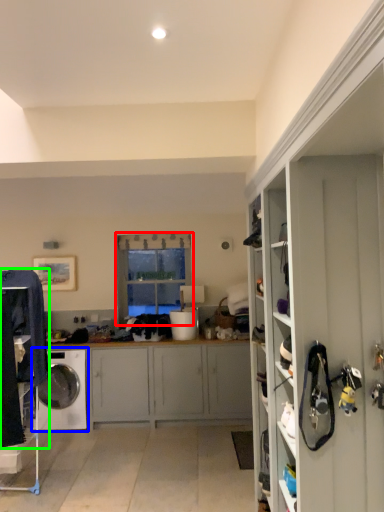
Question: Based on their relative distances, which object is nearer to window (highlighted by a red box)? Choose from washing machine (highlighted by a blue box) and clothing (highlighted by a green box).

Choices:
 (A) washing machine
 (B) clothing

Answer: (A)